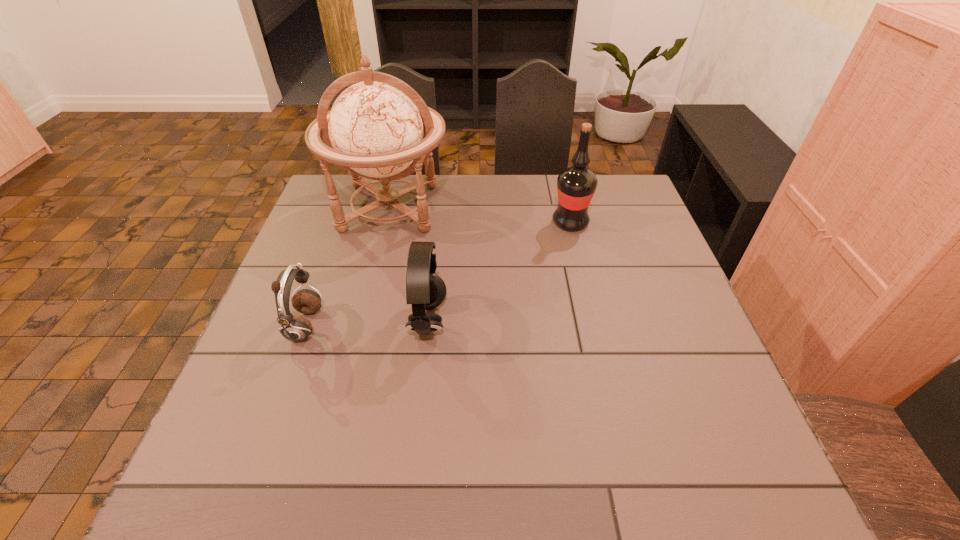
This screenshot has height=540, width=960. In order to click on globe in this screenshot , I will do `click(375, 130)`.

In order to click on the rightmost object in this screenshot , I will do `click(576, 185)`.

Image resolution: width=960 pixels, height=540 pixels. Identify the location of wine bottle. (576, 185).

You are a GUI agent. You are given a task and a screenshot of the screen. Output one action in this format:
    pyautogui.click(x=<x>, y=<y>)
    Task: Click on the second shortest object
    This screenshot has width=960, height=540.
    Given the screenshot: What is the action you would take?
    pyautogui.click(x=425, y=290)

This screenshot has width=960, height=540. Identify the location of the taller earphone. (425, 290).

The width and height of the screenshot is (960, 540). Identify the location of the shortest object. (295, 328).

The width and height of the screenshot is (960, 540). I want to click on the shorter earphone, so click(x=295, y=328).

Image resolution: width=960 pixels, height=540 pixels. What are the coordinates of `vacant space located 0.230m at the front of the globe showing Africa` in the screenshot? It's located at (364, 308).

Find the location of a particular element. This screenshot has width=960, height=540. vacant position located on the right of the second tallest object is located at coordinates (639, 222).

Find the location of a particular element. Image resolution: width=960 pixels, height=540 pixels. vacant space located 0.250m on the ear cups of the right earphone is located at coordinates (554, 322).